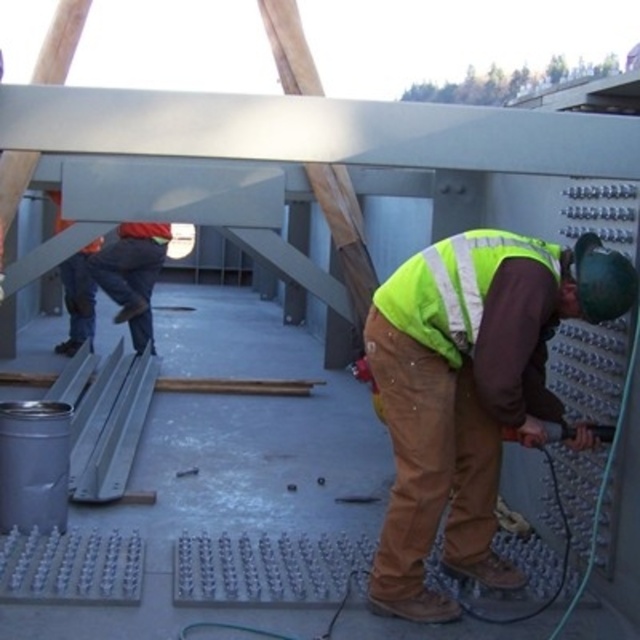
Is high visibility yellow safety vest at lower right to the left of orange reflective vest at upper left from the viewer's perspective?

In fact, high visibility yellow safety vest at lower right is to the right of orange reflective vest at upper left.

Is point (396, 333) more distant than point (99, 264)?

No, it is not.

Between point (424, 484) and point (124, 244), which one is positioned behind?

The point (124, 244) is more distant.

Identify the location of high visibility yellow safety vest at lower right. The height and width of the screenshot is (640, 640). (468, 388).